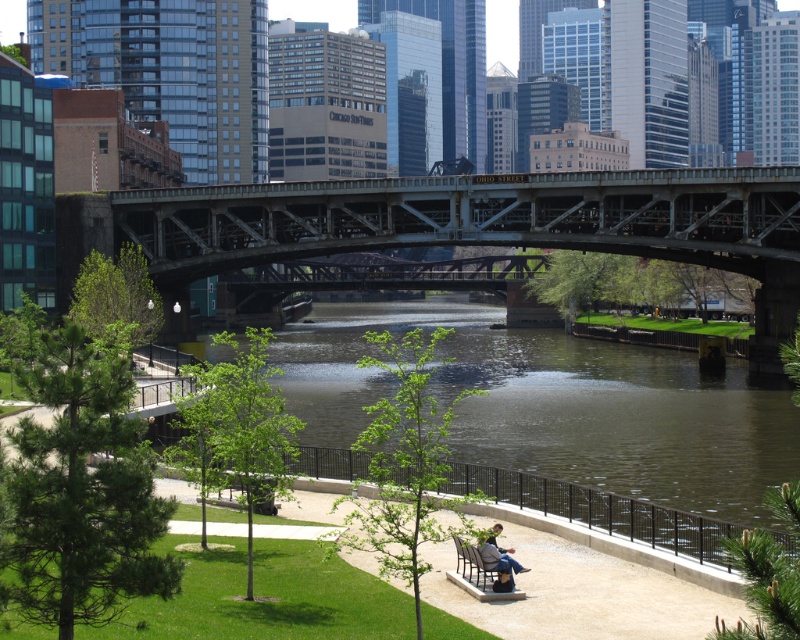
You are a tourist standing on the riverside path and want to take a photo of both the green water at center and the metallic gray bridge at center. Which object will appear larger in your photo?

The green water at center will appear larger in your photo because it is closer to the viewer than the metallic gray bridge at center.

You are standing on the pedestrian bridge and want to know the exact location of the green water at center in the image. What are its coordinates?

The green water at center is located at point coordinates (558,417).